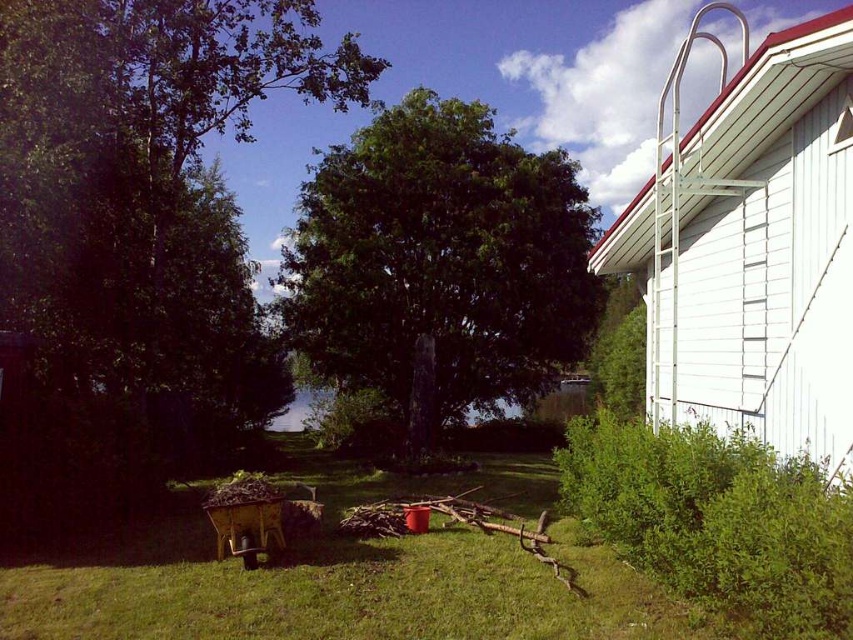
Question: Which object appears closest to the camera in this image?

Choices:
 (A) green grass at center
 (B) green leafy tree at center
 (C) green leafy tree at left

Answer: (A)

Question: Which of the following is the farthest from the observer?

Choices:
 (A) (583, 227)
 (B) (804, 147)
 (C) (97, 259)

Answer: (A)

Question: Can you confirm if white wooden ladder at upper right is positioned to the right of green leafy tree at center?

Choices:
 (A) no
 (B) yes

Answer: (B)

Question: Is green leafy tree at left behind green grass at center?

Choices:
 (A) yes
 (B) no

Answer: (A)

Question: Which point is farther from the camera taking this photo?

Choices:
 (A) click(691, 380)
 (B) click(378, 484)
 (C) click(132, 36)
 (D) click(335, 205)

Answer: (D)

Question: Is green leafy tree at center below green grass at center?

Choices:
 (A) no
 (B) yes

Answer: (A)